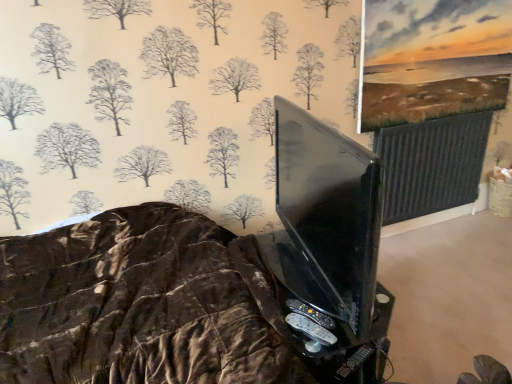
Question: Should I look upward or downward to see black plastic game controller at lower center?

Choices:
 (A) up
 (B) down

Answer: (B)

Question: Is the position of black glossy tv stand at lower center less distant than that of black plastic game controller at lower center?

Choices:
 (A) yes
 (B) no

Answer: (A)

Question: Can you confirm if black glossy tv stand at lower center is shorter than black plastic game controller at lower center?

Choices:
 (A) no
 (B) yes

Answer: (A)

Question: Could black plastic game controller at lower center be considered to be inside black glossy tv stand at lower center?

Choices:
 (A) yes
 (B) no

Answer: (B)

Question: Is black glossy tv stand at lower center further to the viewer compared to black plastic game controller at lower center?

Choices:
 (A) no
 (B) yes

Answer: (A)

Question: Does black glossy tv stand at lower center have a lesser width compared to black plastic game controller at lower center?

Choices:
 (A) yes
 (B) no

Answer: (B)

Question: Considering the relative positions of black glossy tv stand at lower center and black plastic game controller at lower center in the image provided, is black glossy tv stand at lower center to the right of black plastic game controller at lower center from the viewer's perspective?

Choices:
 (A) yes
 (B) no

Answer: (A)

Question: Is black plastic game controller at lower center to the left of black glossy tv stand at lower center from the viewer's perspective?

Choices:
 (A) yes
 (B) no

Answer: (A)

Question: From a real-world perspective, is black plastic game controller at lower center under black glossy tv stand at lower center?

Choices:
 (A) yes
 (B) no

Answer: (B)

Question: Could you tell me if black plastic game controller at lower center is turned towards black glossy tv stand at lower center?

Choices:
 (A) yes
 (B) no

Answer: (B)

Question: Does black plastic game controller at lower center appear on the right side of black glossy tv stand at lower center?

Choices:
 (A) yes
 (B) no

Answer: (B)

Question: Is black plastic game controller at lower center positioned with its back to black glossy tv stand at lower center?

Choices:
 (A) no
 (B) yes

Answer: (A)

Question: From the image's perspective, is black plastic game controller at lower center below black glossy tv stand at lower center?

Choices:
 (A) yes
 (B) no

Answer: (B)

Question: From the image's perspective, is black plastic game controller at lower center positioned above or below black glossy tv stand at lower center?

Choices:
 (A) above
 (B) below

Answer: (A)